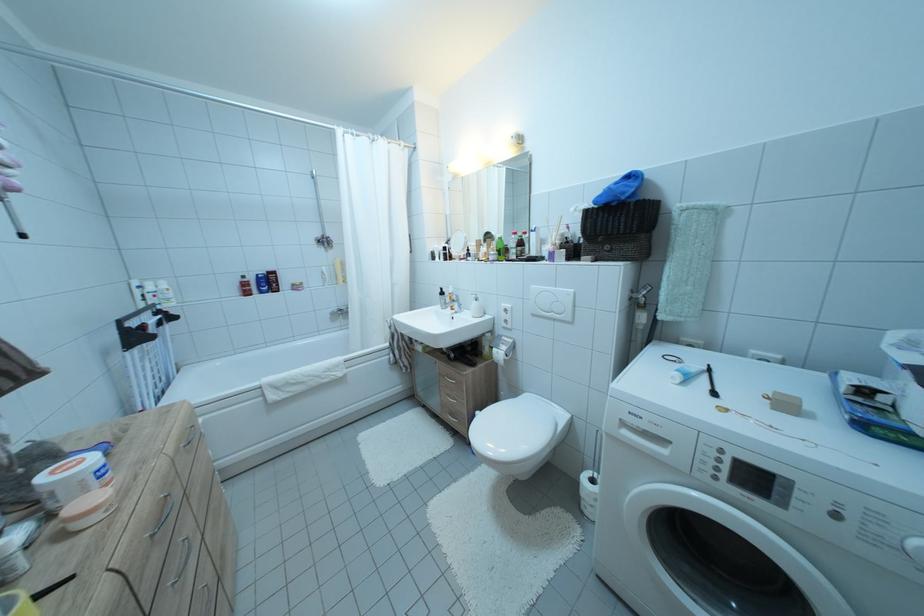
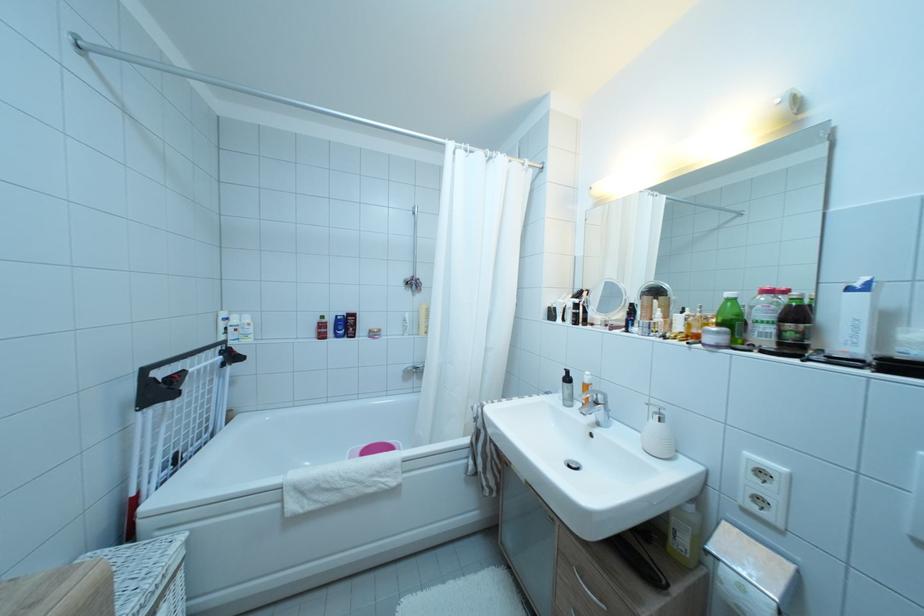
Find the pixel in the second image that matches (x=506, y=241) in the first image.

(736, 300)